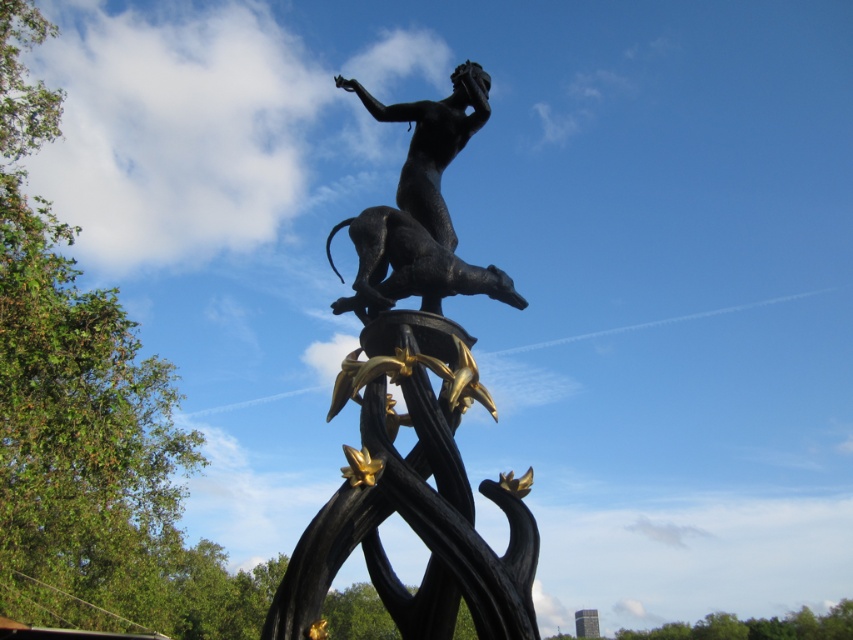
Question: Among these points, which one is nearest to the camera?

Choices:
 (A) (416, 145)
 (B) (474, 573)

Answer: (B)

Question: Which point is closer to the camera?

Choices:
 (A) (440, 156)
 (B) (347, 452)

Answer: (B)

Question: Where is black polished statue at center located in relation to black polished statue at upper center in the image?

Choices:
 (A) left
 (B) right

Answer: (B)

Question: Among these points, which one is nearest to the camera?

Choices:
 (A) (442, 129)
 (B) (415, 468)

Answer: (B)

Question: Where is black polished statue at center located in relation to black polished statue at upper center in the image?

Choices:
 (A) above
 (B) below

Answer: (B)

Question: Can you confirm if black polished statue at center is smaller than black polished statue at upper center?

Choices:
 (A) no
 (B) yes

Answer: (A)